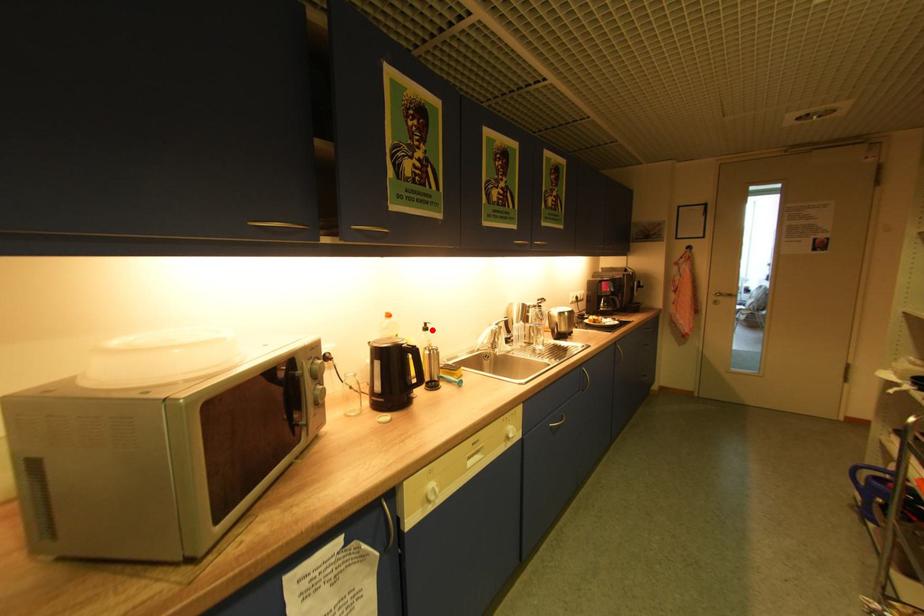
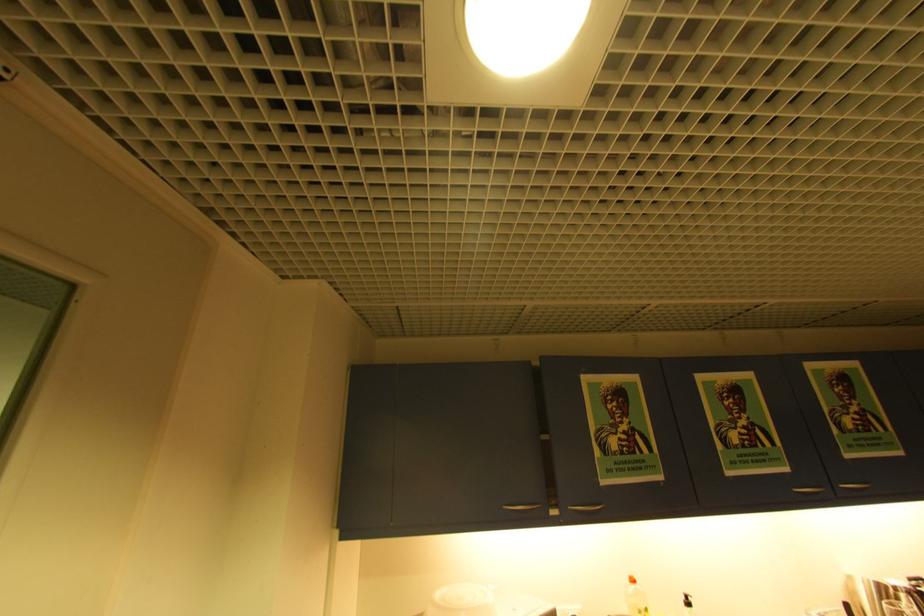
Question: I am providing you with two images of the same scene from different viewpoints. Image1 has a red point marked. In image2, the corresponding 3D location appears at what relative position? Reply with the corresponding letter.

Choices:
 (A) Closer
 (B) Farther

Answer: (A)